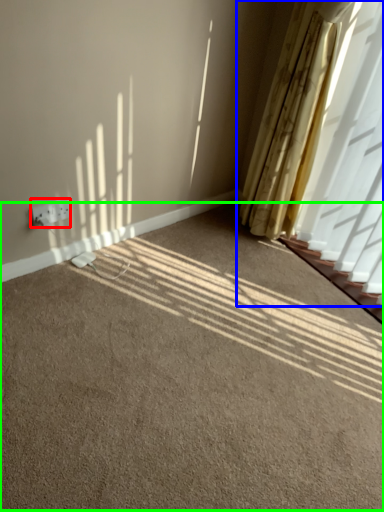
Question: Based on their relative distances, which object is nearer to electric outlet (highlighted by a red box)? Choose from curtain (highlighted by a blue box) and plain (highlighted by a green box).

Choices:
 (A) curtain
 (B) plain

Answer: (B)